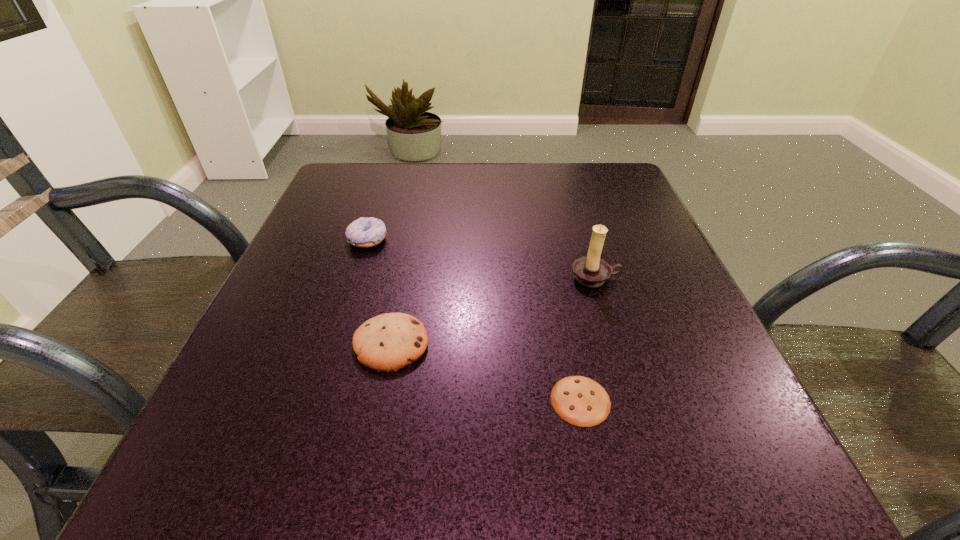
The width and height of the screenshot is (960, 540). Identify the location of the third nearest object. (591, 271).

Identify the location of candle holder. This screenshot has height=540, width=960. (591, 271).

Where is `doughnut`? The width and height of the screenshot is (960, 540). doughnut is located at coordinates (366, 232).

Where is `the farther cookie`? the farther cookie is located at coordinates (388, 342).

Where is `the left cookie`? Image resolution: width=960 pixels, height=540 pixels. the left cookie is located at coordinates (388, 342).

Where is `the nearest object`? the nearest object is located at coordinates (581, 401).

The height and width of the screenshot is (540, 960). Identify the location of the nearer cookie. (581, 401).

You are a GUI agent. You are given a task and a screenshot of the screen. Output one action in this format:
    pyautogui.click(x=<x>, y=<y>)
    Task: Click on the vacant region located 0.320m on the wick of the candle holder
    The width and height of the screenshot is (960, 540).
    Given the screenshot: What is the action you would take?
    (x=652, y=465)

The image size is (960, 540). In order to click on blank space located 0.050m on the right of the doughnut in this screenshot , I will do `click(412, 239)`.

Where is `free space located on the back of the taller cookie`? free space located on the back of the taller cookie is located at coordinates (420, 199).